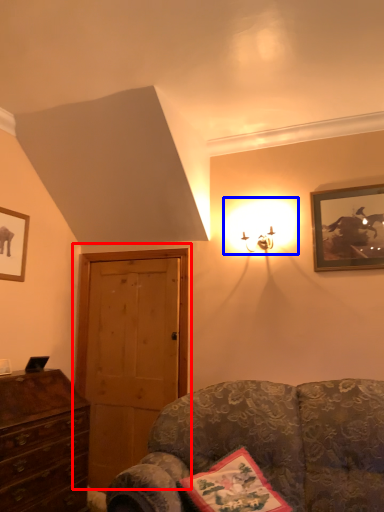
Question: Which object is closer to the camera taking this photo, door (highlighted by a red box) or light (highlighted by a blue box)?

Choices:
 (A) door
 (B) light

Answer: (B)